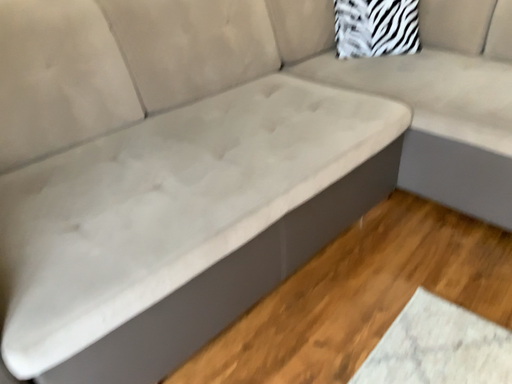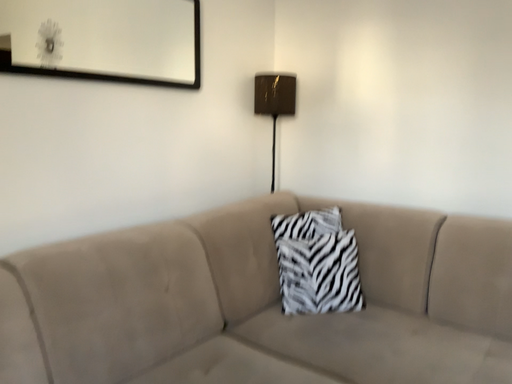
Question: Which way did the camera rotate in the video?

Choices:
 (A) rotated upward
 (B) rotated downward

Answer: (A)